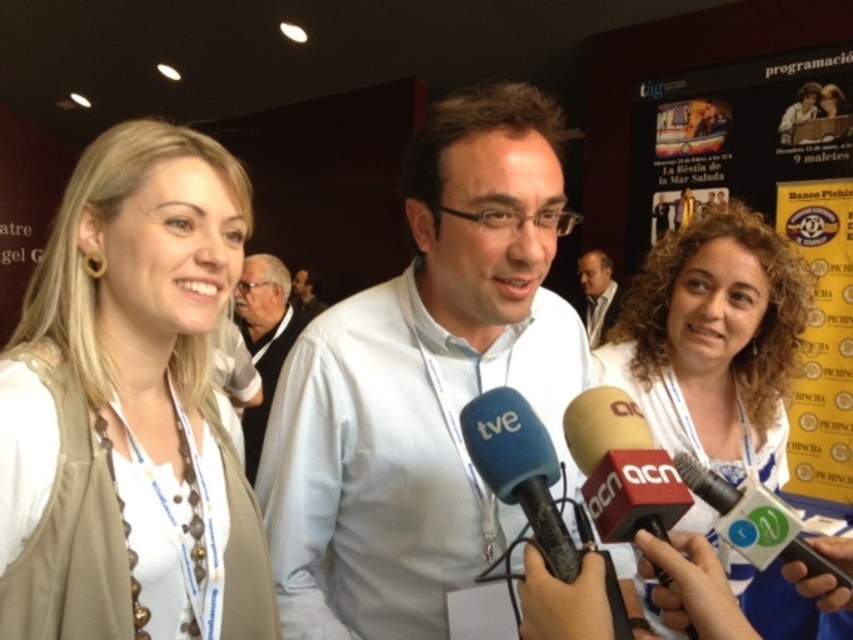
Which is more to the left, curly hair at center or dark gray suit at center?

Positioned to the left is dark gray suit at center.

Does curly hair at center have a larger size compared to dark gray suit at center?

Yes, curly hair at center is bigger than dark gray suit at center.

You are a GUI agent. You are given a task and a screenshot of the screen. Output one action in this format:
    pyautogui.click(x=<x>, y=<y>)
    Task: Click on the curly hair at center
    This screenshot has width=853, height=640.
    Given the screenshot: What is the action you would take?
    pyautogui.click(x=714, y=340)

Consider the image. Which is more to the right, white fabric vest at center or dark brown leather jacket at center?

dark brown leather jacket at center

Can you confirm if white fabric vest at center is wider than dark brown leather jacket at center?

Yes.

Does point (252, 257) come in front of point (589, 272)?

Yes, it is in front of point (589, 272).

At what (x,y) coordinates should I click in order to perform the action: click on white fabric vest at center. Please return your answer as a coordinate pair (x, y). Looking at the image, I should click on (264, 339).

Describe the element at coordinates (422, 381) in the screenshot. This screenshot has width=853, height=640. I see `white matte shirt at center` at that location.

Who is more distant from viewer, (265, 492) or (236, 285)?

The point (236, 285) is more distant.

Find the location of a particular element. white matte shirt at center is located at coordinates (422, 381).